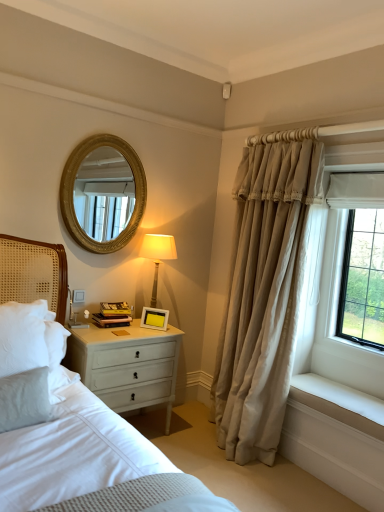
Question: Would you consider white painted wood nightstand at lower left to be distant from gold textured mirror at upper center?

Choices:
 (A) no
 (B) yes

Answer: (B)

Question: Is white painted wood nightstand at lower left oriented towards gold textured mirror at upper center?

Choices:
 (A) no
 (B) yes

Answer: (A)

Question: Considering the relative sizes of white painted wood nightstand at lower left and gold textured mirror at upper center in the image provided, is white painted wood nightstand at lower left smaller than gold textured mirror at upper center?

Choices:
 (A) yes
 (B) no

Answer: (B)

Question: Is gold textured mirror at upper center completely or partially inside white painted wood nightstand at lower left?

Choices:
 (A) no
 (B) yes

Answer: (A)

Question: Can you see white painted wood nightstand at lower left touching gold textured mirror at upper center?

Choices:
 (A) no
 (B) yes

Answer: (A)

Question: Is beige fabric curtain at right taller or shorter than white painted wood nightstand at lower left?

Choices:
 (A) tall
 (B) short

Answer: (A)

Question: From the image's perspective, is beige fabric curtain at right above or below white painted wood nightstand at lower left?

Choices:
 (A) above
 (B) below

Answer: (A)

Question: Is beige fabric curtain at right bigger or smaller than white painted wood nightstand at lower left?

Choices:
 (A) small
 (B) big

Answer: (B)

Question: In the image, is beige fabric curtain at right on the left side or the right side of white painted wood nightstand at lower left?

Choices:
 (A) left
 (B) right

Answer: (B)

Question: From a real-world perspective, is white matte picture frame at upper right above or below beige fabric curtain at right?

Choices:
 (A) above
 (B) below

Answer: (B)

Question: Does point (145, 326) appear closer or farther from the camera than point (243, 416)?

Choices:
 (A) closer
 (B) farther

Answer: (B)

Question: In terms of size, does white matte picture frame at upper right appear bigger or smaller than beige fabric curtain at right?

Choices:
 (A) small
 (B) big

Answer: (A)

Question: Would you say white matte picture frame at upper right is inside or outside beige fabric curtain at right?

Choices:
 (A) inside
 (B) outside

Answer: (B)

Question: From a real-world perspective, is white matte picture frame at upper right physically located above or below white smooth window sill at lower right?

Choices:
 (A) below
 (B) above

Answer: (B)

Question: Is white matte picture frame at upper right in front of or behind white smooth window sill at lower right in the image?

Choices:
 (A) behind
 (B) front

Answer: (A)